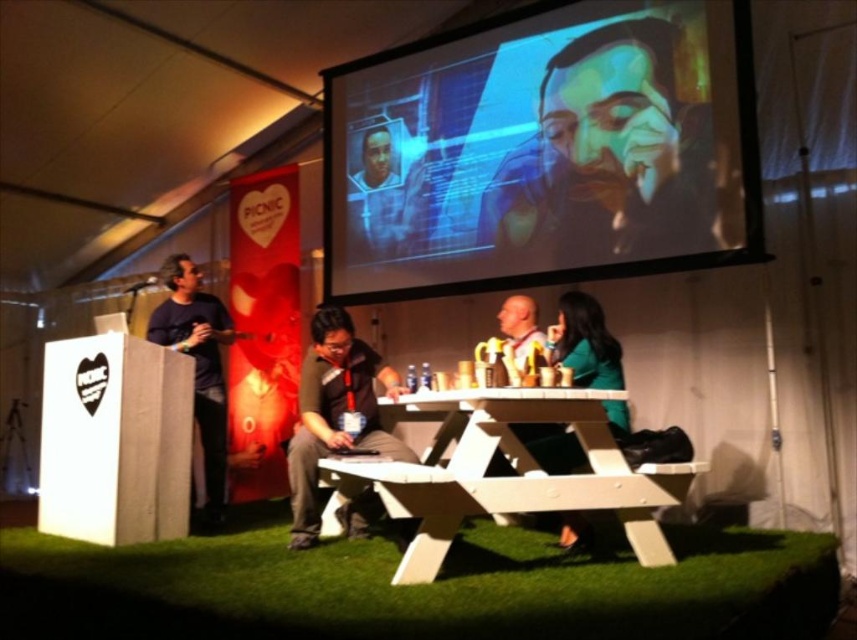
You are an event planner trying to set up a projector for the upcoming presentation. The projector needs to be placed at point 0.3, 0.7. Will the projector be positioned to the left or right of the matte plastic projection screen at upper center?

The projector will be positioned to the right of the matte plastic projection screen at upper center because the projector is at point (598, 192) and the screen is at point (544, 150). Since the x coordinate of the projector is higher than the screen, it is to the right.

In the scene shown: Based on the scene description, can you determine if the matte plastic projection screen at upper center is positioned higher than the matte black jacket at center?

Yes, the matte plastic projection screen at upper center is located above the matte black jacket at center, so it is positioned higher.

You are planning to place a large decorative arrangement on the white wood picnic table at center. The arrangement requires a space that is wider than the matte black jacket at center. Can the table accommodate it?

The white wood picnic table at center might be wider than matte black jacket at center, so it is possible that the table can accommodate the arrangement. However, the exact dimensions are uncertain based on the provided information.